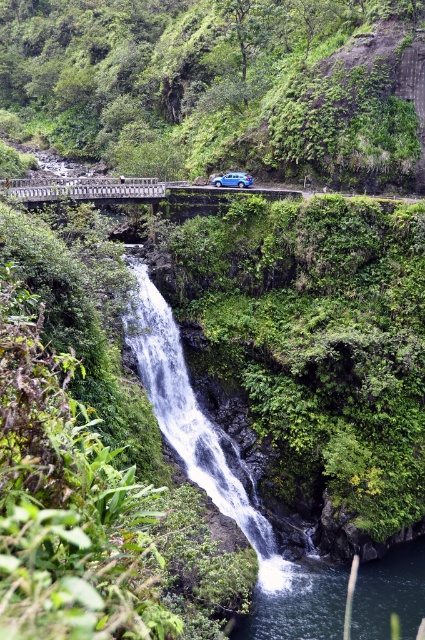
Consider the image. Who is more forward, (x=306, y=1) or (x=217, y=184)?

Point (x=217, y=184)

In the scene shown: Is green leafy vegetation at center thinner than blue matte car at center?

Incorrect, green leafy vegetation at center's width is not less than blue matte car at center's.

What are the coordinates of `green leafy vegetation at center` in the screenshot? It's located at (223, 84).

Where is `green leafy vegetation at center`? green leafy vegetation at center is located at coordinates (223, 84).

Based on the photo, is clear water at lower center smaller than blue matte car at center?

No.

Who is more distant from viewer, (388, 596) or (234, 182)?

The point (234, 182) is more distant.

Image resolution: width=425 pixels, height=640 pixels. What do you see at coordinates (300, 605) in the screenshot?
I see `clear water at lower center` at bounding box center [300, 605].

The image size is (425, 640). What are the coordinates of `clear water at lower center` in the screenshot? It's located at (300, 605).

Based on the photo, who is more distant from viewer, [17,1] or [56,195]?

Positioned behind is point [17,1].

Is green leafy vegetation at center thinner than white metal bridge at center?

Incorrect, green leafy vegetation at center's width is not less than white metal bridge at center's.

Who is more forward, (48, 74) or (79, 179)?

Point (79, 179) is more forward.

Identify the location of green leafy vegetation at center. (223, 84).